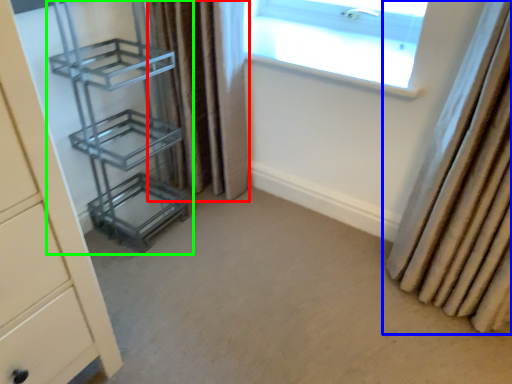
Question: Based on their relative distances, which object is farther from curtain (highlighted by a red box)? Choose from curtain (highlighted by a blue box) and shelf (highlighted by a green box).

Choices:
 (A) curtain
 (B) shelf

Answer: (A)